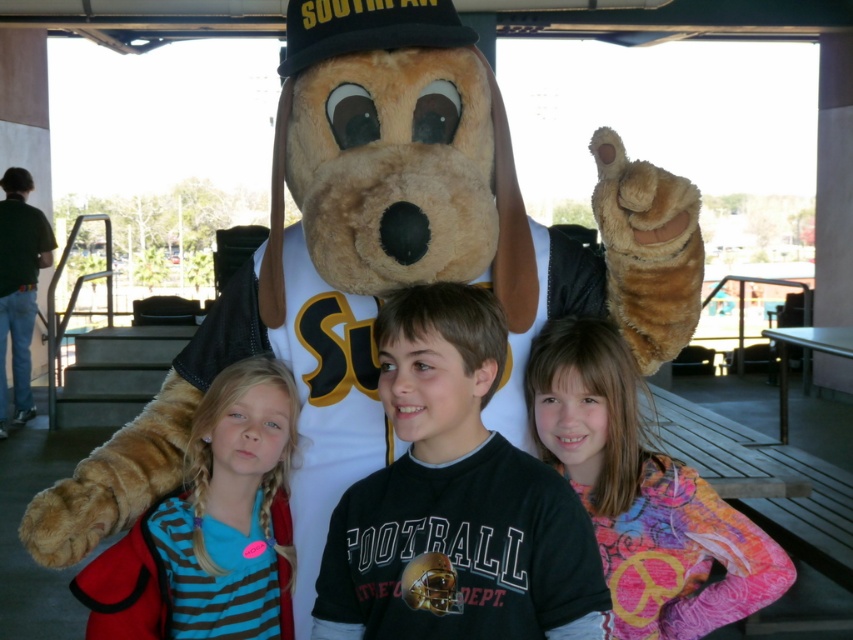
You are taking a photo of the children and the mascot. You want to focus on the point at point (408, 580) and point (247, 476). Which point should you focus on first to ensure both are in focus?

You should focus on point (247, 476) first because it is farther from the camera, and focusing on the farther point first will help ensure both points are within the depth of field.

You are a photographer setting up for a group photo. You notice two shirts in the scene, the black cotton shirt at center and the striped fabric shirt at center. Which shirt is taller?

The black cotton shirt at center has a greater height compared to the striped fabric shirt at center.

You are a photographer setting up for a group photo. The subject wearing the black cotton shirt at center is currently 5.29 feet away from the camera. To ensure proper framing, you need the subject to be exactly 6 feet away. Should the subject move closer or farther away?

The black cotton shirt at center is currently 5.29 feet from the camera, which is closer than the desired 6 feet. The subject should move farther away to reach the correct distance.